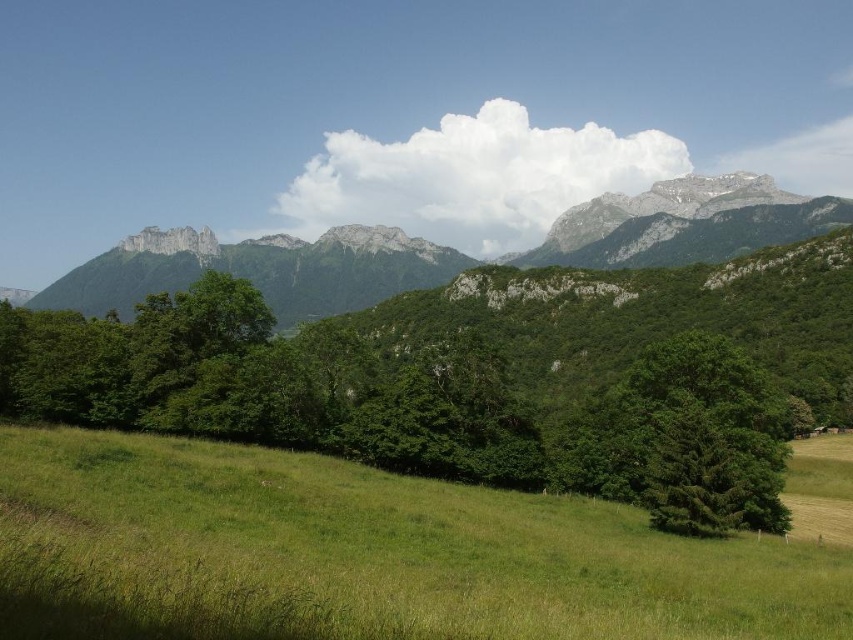
You are standing at the point marked as point (363, 554) in the image. What do you see around you?

You are standing in the green grassy field at lower center located at point (363, 554).

You are standing in the meadow and see two points marked in the image. One is at point (151, 236) and the other is at point (683, 465). Which point is closer to you?

Point (151, 236) is further to the camera than point (683, 465), so the point closer to you is point (683, 465).